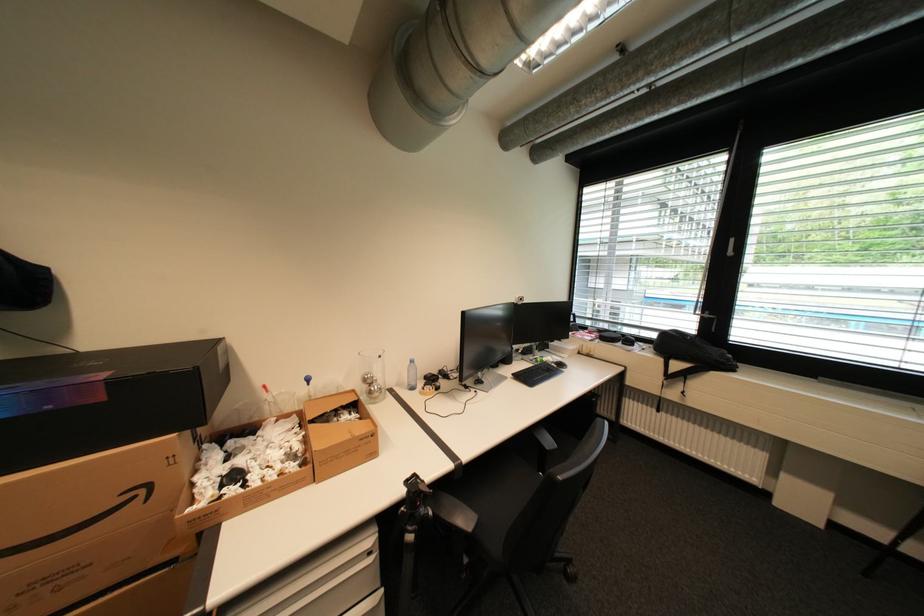
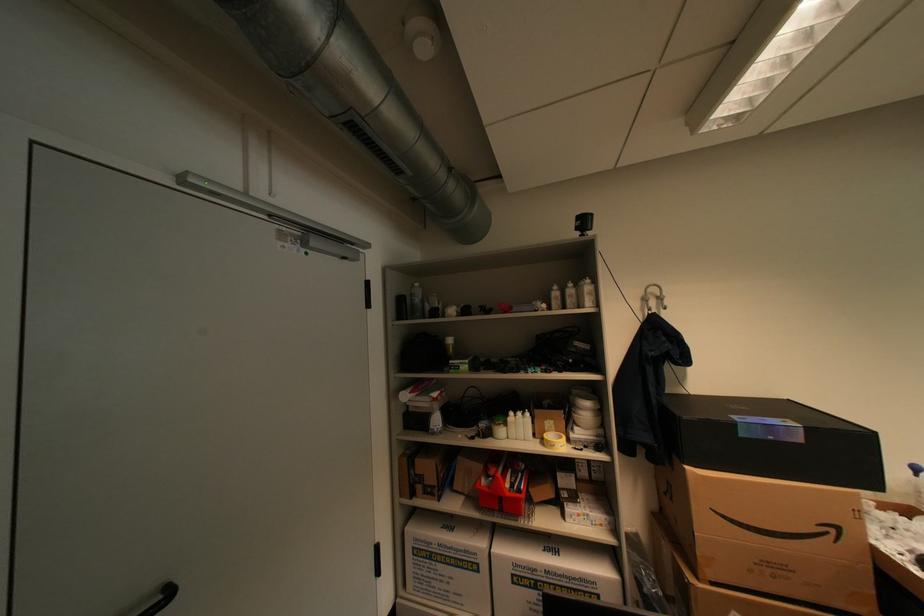
Where in the second image is the point corresponding to (x=151, y=491) from the first image?

(841, 531)